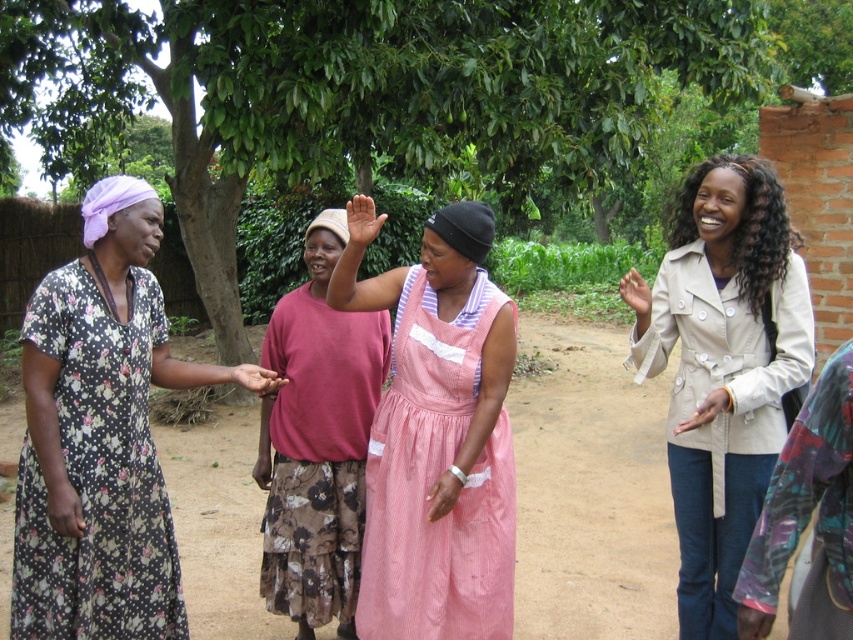
Who is shorter, floral printed dress at left or matte pink shirt at center?

floral printed dress at left is shorter.

Is floral printed dress at left closer to the viewer compared to matte pink shirt at center?

Yes, it is in front of matte pink shirt at center.

What do you see at coordinates (97, 472) in the screenshot? I see `floral printed dress at left` at bounding box center [97, 472].

Where is `floral printed dress at left`? This screenshot has width=853, height=640. floral printed dress at left is located at coordinates (97, 472).

Who is taller, floral printed dress at left or pink corduroy dress at center?

With more height is pink corduroy dress at center.

Between point (91, 579) and point (469, 584), which one is positioned behind?

The point (469, 584) is more distant.

At what (x,y) coordinates should I click in order to perform the action: click on floral printed dress at left. Please return your answer as a coordinate pair (x, y). The width and height of the screenshot is (853, 640). Looking at the image, I should click on (97, 472).

Is point (555, 384) more distant than point (407, 378)?

That is True.

This screenshot has height=640, width=853. In order to click on brown dirt field at center in this screenshot , I will do `click(590, 490)`.